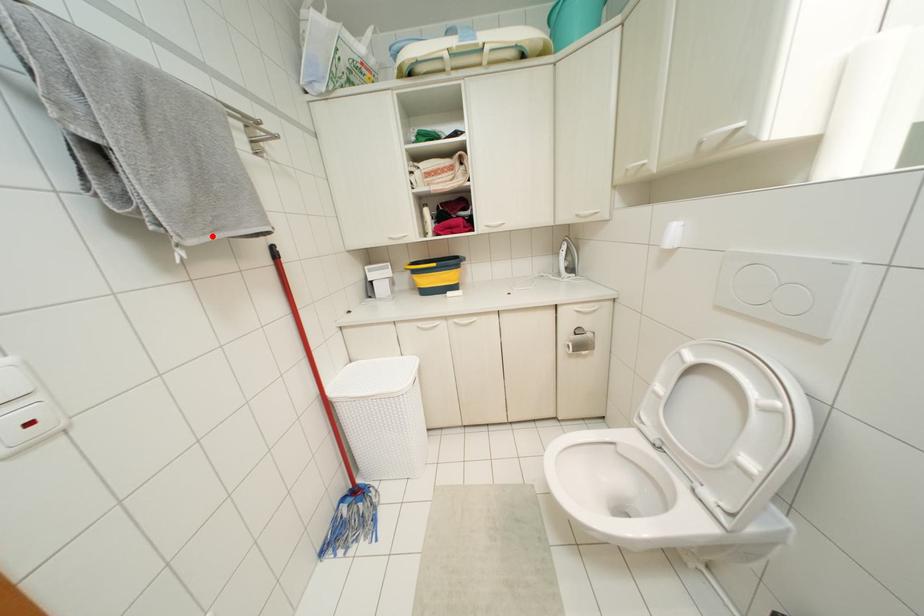
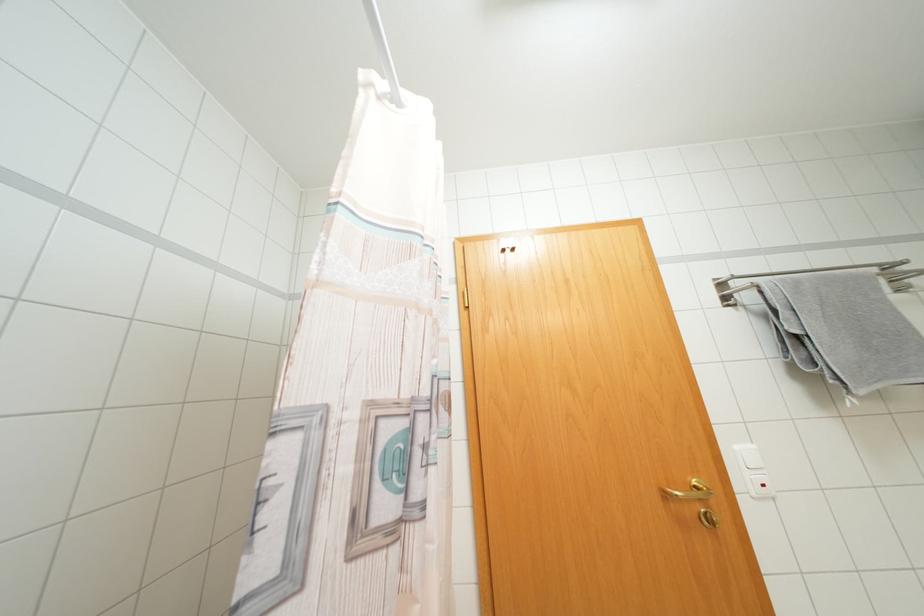
In the second image, find the point that corresponds to the highlighted location in the first image.

(877, 386)